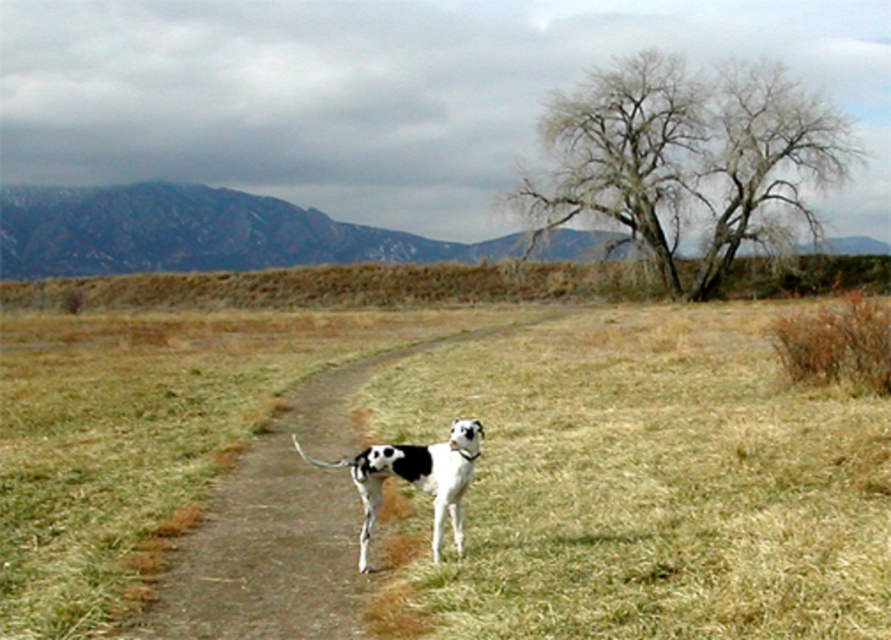
You are a photographer standing at the edge of a grassy field. You want to take a photo of the white smooth dog at center. If your camera has a maximum focus range of 20 feet, will you be able to capture the dog clearly?

The white smooth dog at center is 18.94 feet away from the camera. Since the maximum focus range is 20 feet, the distance of 18.94 feet is within the range. Therefore, the camera can focus on the white smooth dog at center clearly.